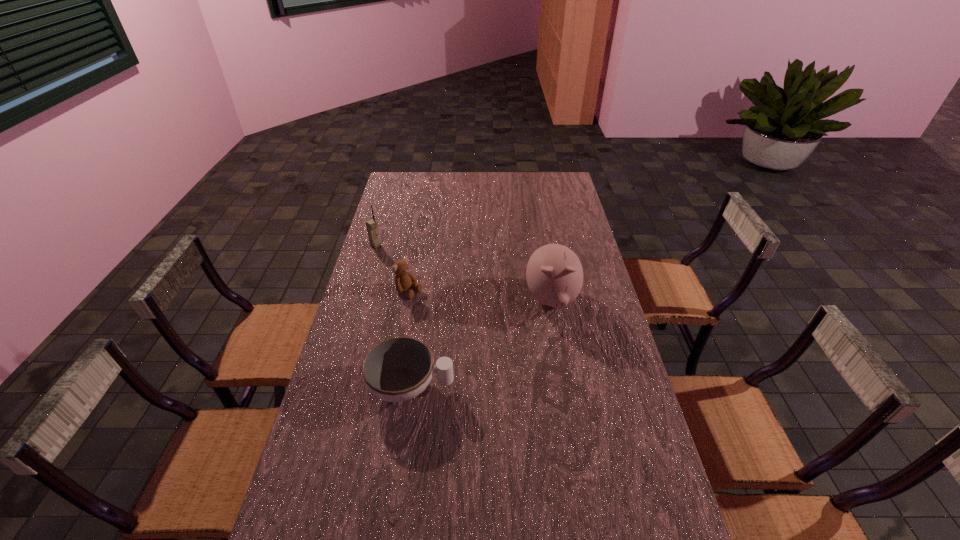
Where is `the nearest object`? Image resolution: width=960 pixels, height=540 pixels. the nearest object is located at coordinates (399, 369).

Identify the location of chinaware. This screenshot has height=540, width=960. (399, 369).

Locate an element on the screen. The image size is (960, 540). the rightmost object is located at coordinates (554, 273).

I want to click on teddy bear, so click(403, 279).

Where is `cellular telephone`? The image size is (960, 540). cellular telephone is located at coordinates (371, 225).

This screenshot has width=960, height=540. In order to click on the farthest object in this screenshot , I will do `click(371, 225)`.

This screenshot has width=960, height=540. In order to click on vacant space located on the side with the handle of the nearest object in this screenshot , I will do click(x=529, y=387).

Locate an element on the screen. vacant area situated at the snout of the rightmost object is located at coordinates (561, 352).

You are a GUI agent. You are given a task and a screenshot of the screen. Output one action in this format:
    pyautogui.click(x=<x>, y=<y>)
    Task: Click on the free space located 0.310m on the front-facing side of the teddy bear
    The image size is (960, 540).
    Given the screenshot: What is the action you would take?
    pyautogui.click(x=490, y=336)

I want to click on vacant area located 0.110m on the front-facing side of the teddy bear, so pyautogui.click(x=443, y=310).